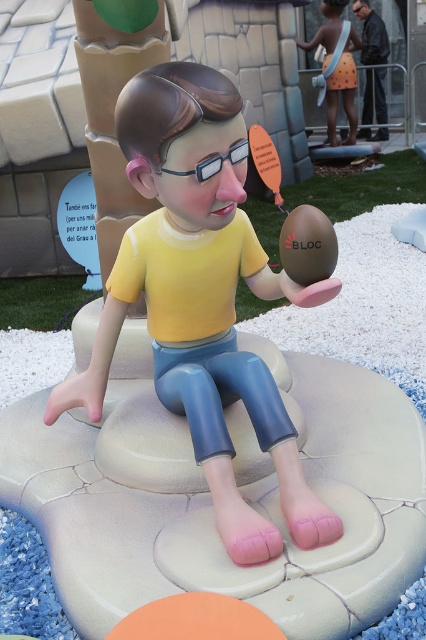
You are an artist trying to paint the scene. You need to decide the order of painting elements based on their height. Which object should you paint first, the matte yellow shirt at center or the orange fabric towel at upper right?

The orange fabric towel at upper right is taller than the matte yellow shirt at center, so you should paint the orange fabric towel at upper right first as it is taller.

Looking at this image, you are an artist trying to create a miniature version of the scene. You need to ensure that the leather jacket at upper right and clear plastic goggles at center are scaled proportionally. Which object should you make smaller to maintain the correct size relationship?

The clear plastic goggles at center should be made smaller since the leather jacket at upper right is larger in size than the clear plastic goggles at center in the original scene.

You are standing at the origin point in the image. Which of the two points, point [354,92] or point [365,51], is closer to you?

Point [354,92] is in front of point [365,51], so it is closer to you.